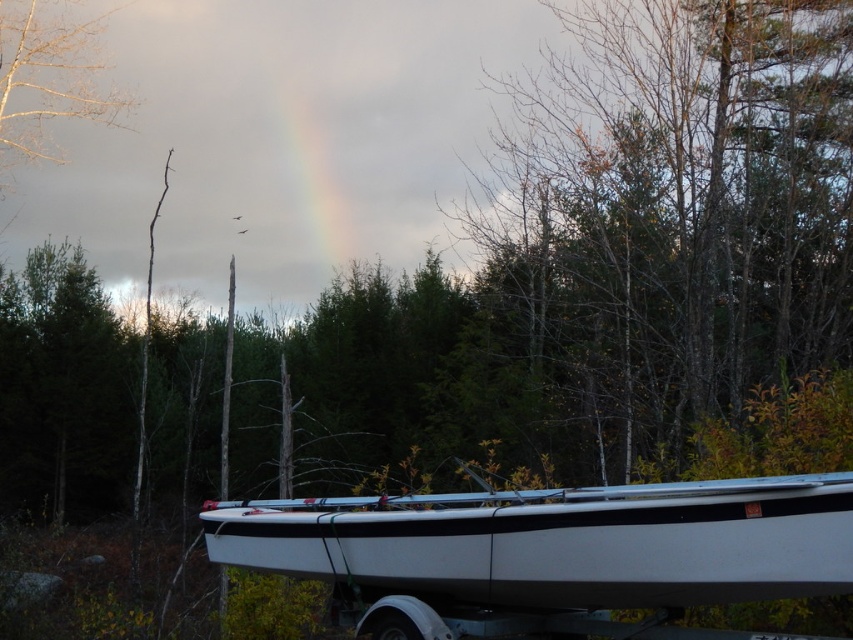
Question: Can you confirm if bare branches at center is positioned above bare branches at upper left?

Choices:
 (A) yes
 (B) no

Answer: (B)

Question: Does bare branches at center have a smaller size compared to white matte boat at lower center?

Choices:
 (A) no
 (B) yes

Answer: (A)

Question: Is bare branches at center positioned at the back of bare branches at upper left?

Choices:
 (A) yes
 (B) no

Answer: (B)

Question: Which of the following is the farthest from the observer?

Choices:
 (A) white matte boat at lower center
 (B) bare branches at upper left
 (C) bare branches at center

Answer: (B)

Question: Among these points, which one is nearest to the camera?

Choices:
 (A) (614, 602)
 (B) (49, 113)
 (C) (573, 180)

Answer: (A)

Question: Among these objects, which one is nearest to the camera?

Choices:
 (A) bare branches at upper left
 (B) white matte boat at lower center

Answer: (B)